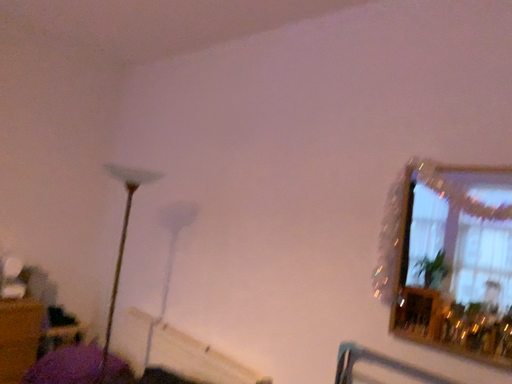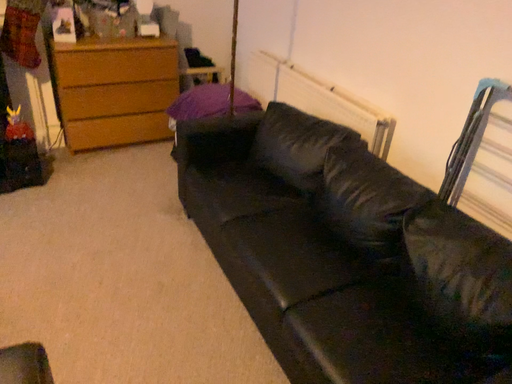
Question: Which way did the camera rotate in the video?

Choices:
 (A) rotated downward
 (B) rotated upward

Answer: (A)